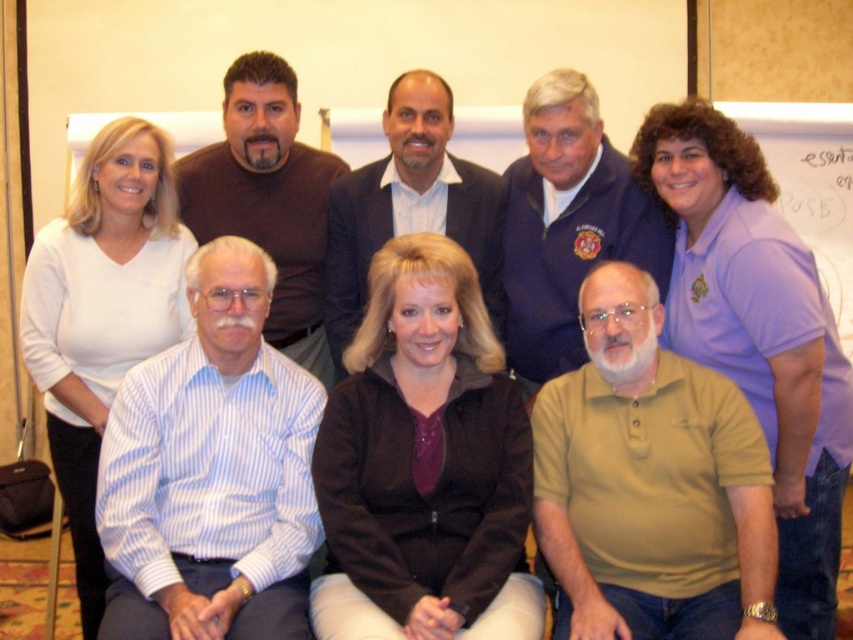
Question: Which object appears farthest from the camera in this image?

Choices:
 (A) blue striped shirt at lower left
 (B) brown zip-up jacket at center
 (C) brownmaterial/textureshirt at upper center
 (D) dark blue suit at center

Answer: (C)

Question: Which point appears farthest from the camera in this image?

Choices:
 (A) (234, 61)
 (B) (222, 561)

Answer: (A)

Question: Does brownmaterial/textureshirt at upper center lie behind dark blue suit at center?

Choices:
 (A) no
 (B) yes

Answer: (B)

Question: Does green polo shirt at lower center have a smaller size compared to blue fleece jacket at upper center?

Choices:
 (A) yes
 (B) no

Answer: (B)

Question: Considering the real-world distances, which object is closest to the brown zip-up jacket at center?

Choices:
 (A) brownmaterial/textureshirt at upper center
 (B) blue fleece jacket at upper center
 (C) purple cotton polo shirt at upper right

Answer: (B)

Question: Does brown zip-up jacket at center appear on the right side of brownmaterial/textureshirt at upper center?

Choices:
 (A) no
 (B) yes

Answer: (B)